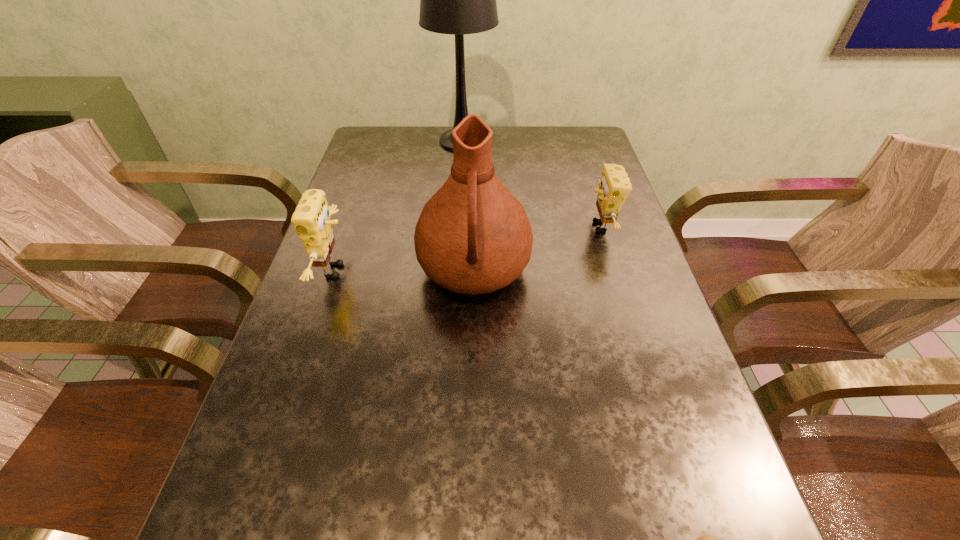
What are the coordinates of `table lamp` in the screenshot? It's located at (457, 0).

Find the location of `the farthest object`. the farthest object is located at coordinates (457, 0).

Where is `the second tallest object`? The image size is (960, 540). the second tallest object is located at coordinates (473, 236).

Locate an element on the screen. The image size is (960, 540). the taller sponge is located at coordinates (311, 220).

Where is `the left sponge`? the left sponge is located at coordinates (311, 220).

Where is `the second shortest object`? This screenshot has height=540, width=960. the second shortest object is located at coordinates (614, 186).

The width and height of the screenshot is (960, 540). What are the coordinates of `the right sponge` in the screenshot? It's located at (614, 186).

You are a GUI agent. You are given a task and a screenshot of the screen. Output one action in this format:
    pyautogui.click(x=<x>, y=<y>)
    Task: Click on the free space located 0.050m on the front of the farthest object
    The width and height of the screenshot is (960, 540).
    Given the screenshot: What is the action you would take?
    pyautogui.click(x=461, y=166)

At what (x,y) coordinates should I click in order to perform the action: click on vacant area situated on the side of the fourth shortest object with the handle. Please return your answer as a coordinate pair (x, y). Looking at the image, I should click on pyautogui.click(x=473, y=345).

Where is `vacant region located on the face of the leftmost object`? The height and width of the screenshot is (540, 960). vacant region located on the face of the leftmost object is located at coordinates (511, 271).